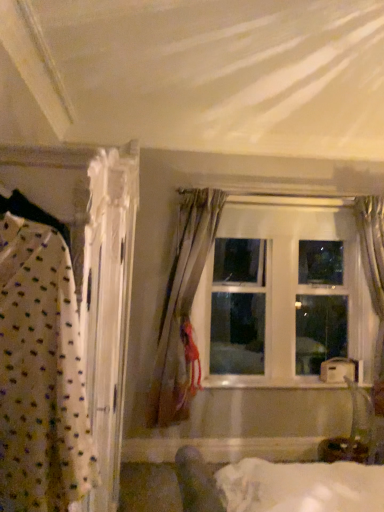
Question: Does clear glass window at center have a greater height compared to satin gray curtain at right, which ranks as the second curtain in left-to-right order?

Choices:
 (A) yes
 (B) no

Answer: (B)

Question: Is clear glass window at center next to satin gray curtain at right, positioned as the first curtain in right-to-left order, and touching it?

Choices:
 (A) no
 (B) yes

Answer: (A)

Question: Is clear glass window at center in front of satin gray curtain at right, which ranks as the second curtain in left-to-right order?

Choices:
 (A) yes
 (B) no

Answer: (B)

Question: Can you confirm if clear glass window at center is thinner than satin gray curtain at right, which ranks as the second curtain in left-to-right order?

Choices:
 (A) yes
 (B) no

Answer: (A)

Question: Could you tell me if clear glass window at center is facing satin gray curtain at right, which ranks as the second curtain in left-to-right order?

Choices:
 (A) no
 (B) yes

Answer: (B)

Question: From a real-world perspective, is satin gray curtain at right, positioned as the first curtain in right-to-left order, physically located above or below silky beige curtain at center, the second curtain in the right-to-left sequence?

Choices:
 (A) above
 (B) below

Answer: (A)

Question: From the image's perspective, is satin gray curtain at right, positioned as the first curtain in right-to-left order, positioned above or below silky beige curtain at center, the second curtain in the right-to-left sequence?

Choices:
 (A) above
 (B) below

Answer: (B)

Question: In terms of height, does satin gray curtain at right, positioned as the first curtain in right-to-left order, look taller or shorter compared to silky beige curtain at center, which is the 1th curtain in left-to-right order?

Choices:
 (A) short
 (B) tall

Answer: (B)

Question: Which is correct: satin gray curtain at right, which ranks as the second curtain in left-to-right order, is inside silky beige curtain at center, which is the 1th curtain in left-to-right order, or outside of it?

Choices:
 (A) inside
 (B) outside

Answer: (B)

Question: Does point [241, 355] appear closer or farther from the camera than point [382, 329]?

Choices:
 (A) closer
 (B) farther

Answer: (B)

Question: Relative to satin gray curtain at right, positioned as the first curtain in right-to-left order, is clear glass window at center in front or behind?

Choices:
 (A) behind
 (B) front

Answer: (A)

Question: Is clear glass window at center taller or shorter than satin gray curtain at right, which ranks as the second curtain in left-to-right order?

Choices:
 (A) short
 (B) tall

Answer: (A)

Question: Is clear glass window at center bigger or smaller than satin gray curtain at right, positioned as the first curtain in right-to-left order?

Choices:
 (A) big
 (B) small

Answer: (A)

Question: Is clear glass window at center to the left or to the right of silky beige curtain at center, the second curtain in the right-to-left sequence, in the image?

Choices:
 (A) left
 (B) right

Answer: (B)

Question: Is clear glass window at center in front of or behind silky beige curtain at center, the second curtain in the right-to-left sequence, in the image?

Choices:
 (A) behind
 (B) front

Answer: (A)